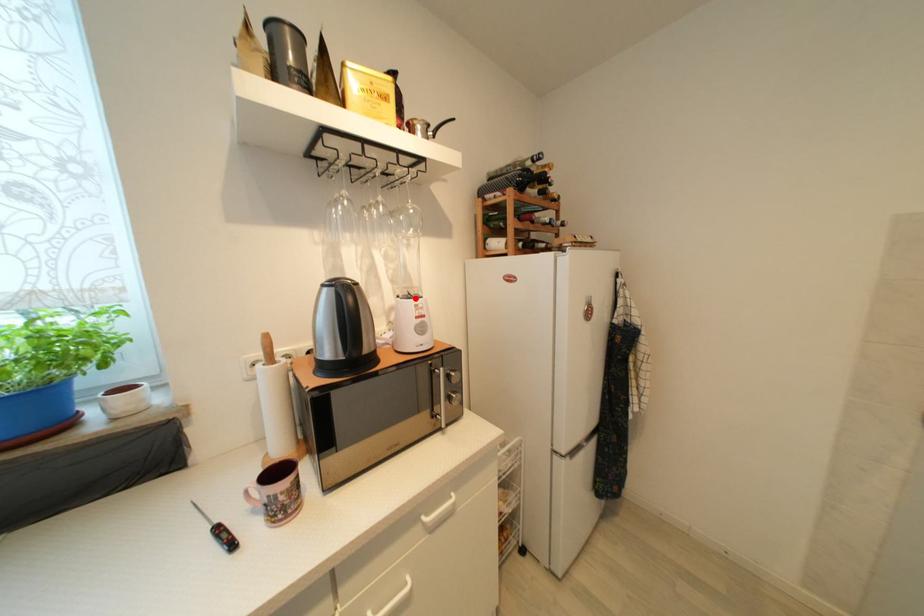
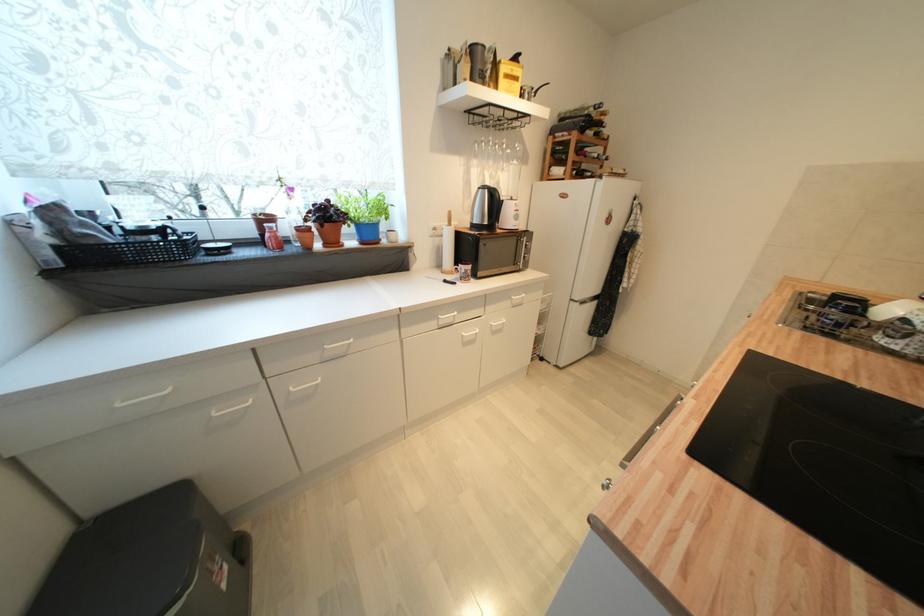
Where in the second image is the point corresponding to the highlighted location from the first image?

(517, 201)